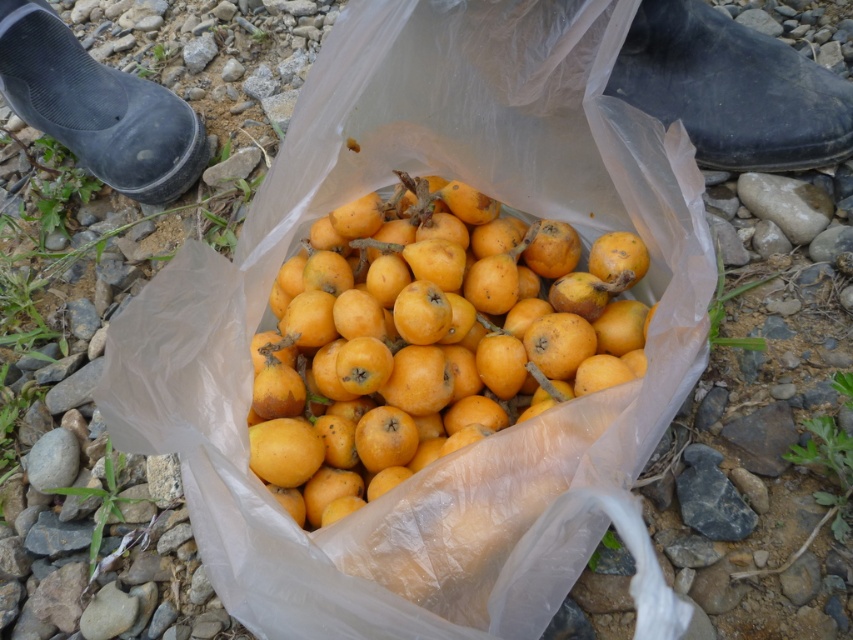
You are a botanist examining the plastic bag of fruits. You need to identify the position of the orange matte fruit at center relative to the bag. According to the coordinates provided, where exactly is it positioned?

The orange matte fruit at center is located at point coordinates of 0.530 in the x axis and 0.502 in the y axis.

You are standing in front of the plastic bag filled with loquats. You notice two points marked in the image. Which point, point (267, 404) or point (42, 36), is closer to you?

Point (267, 404) is closer to the camera than point (42, 36), so it is closer to you.

You are a delivery robot with a 25 inch wide arm. You need to place a package between the orange matte fruit at center and the black rubber boot at upper left. Can your arm fit in the space between them?

The distance between the orange matte fruit at center and the black rubber boot at upper left is 27.03 inches, so the robot arm which is 25 inches wide can fit in the space between them.